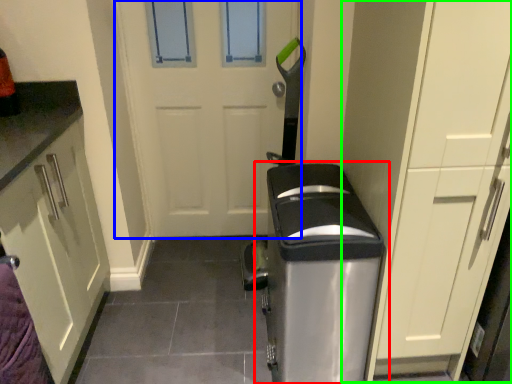
Question: Which object is the farthest from home appliance (highlighted by a red box)? Choose among these: door (highlighted by a blue box) or dresser (highlighted by a green box).

Choices:
 (A) door
 (B) dresser

Answer: (A)